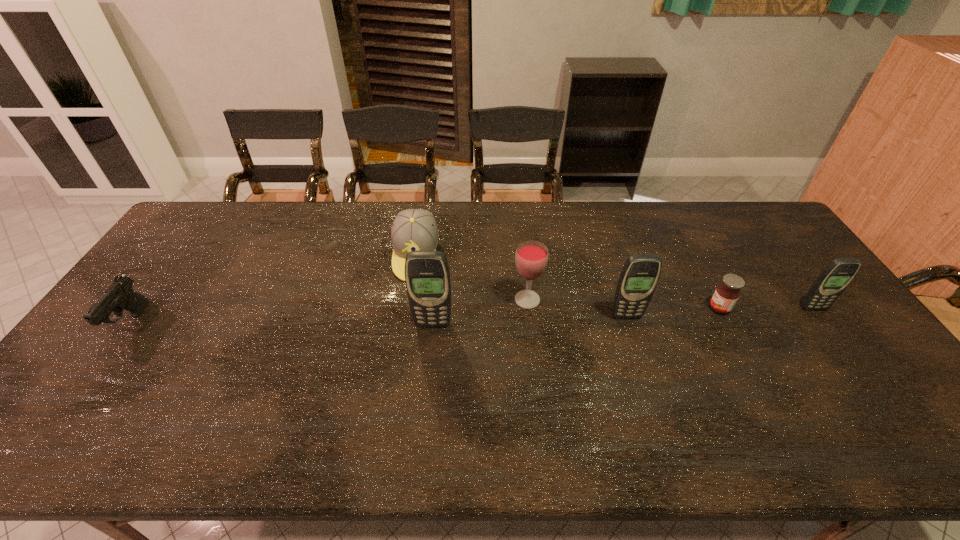
This screenshot has height=540, width=960. I want to click on object at the right edge, so click(838, 274).

The height and width of the screenshot is (540, 960). Find the location of `free point at the far edge`. free point at the far edge is located at coordinates (370, 220).

The width and height of the screenshot is (960, 540). What are the coordinates of `vacant space at the near edge of the desktop` in the screenshot? It's located at (188, 389).

Where is `vacant space at the left edge of the desktop`? The width and height of the screenshot is (960, 540). vacant space at the left edge of the desktop is located at coordinates (96, 345).

At what (x,y) coordinates should I click in order to perform the action: click on free space at the far left corner of the desktop. Please return your answer as a coordinate pair (x, y). The width and height of the screenshot is (960, 540). Looking at the image, I should click on (229, 218).

I want to click on vacant space at the far right corner of the desktop, so click(762, 232).

You are a GUI agent. You are given a task and a screenshot of the screen. Output one action in this format:
    pyautogui.click(x=<x>, y=<y>)
    Task: Click on the unoccupied position between the pistol and the farthest object
    The width and height of the screenshot is (960, 540).
    Given the screenshot: What is the action you would take?
    pyautogui.click(x=274, y=289)

Identify the location of vacant area that lies between the nearest cellular telephone and the fourth object from right to left. (480, 312).

You are a GUI agent. You are given a task and a screenshot of the screen. Output one action in this format:
    pyautogui.click(x=<x>, y=<y>)
    Task: Click on the free spot between the second shortest cellular telephone and the fourth object from right to left
    The height and width of the screenshot is (540, 960).
    Given the screenshot: What is the action you would take?
    pyautogui.click(x=577, y=308)

Identify the location of vacant region between the wineglass and the pistol. (329, 311).